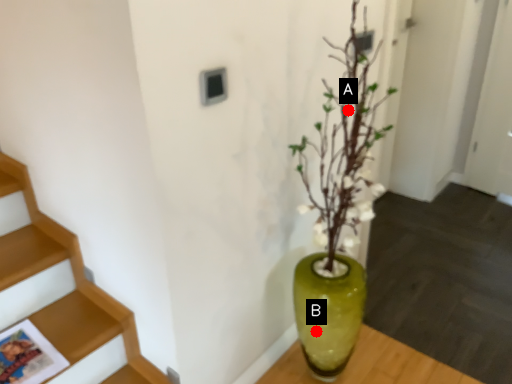
Question: Two points are circled on the image, labeled by A and B beside each circle. Among these points, which one is nearest to the camera?

Choices:
 (A) A is closer
 (B) B is closer

Answer: (A)